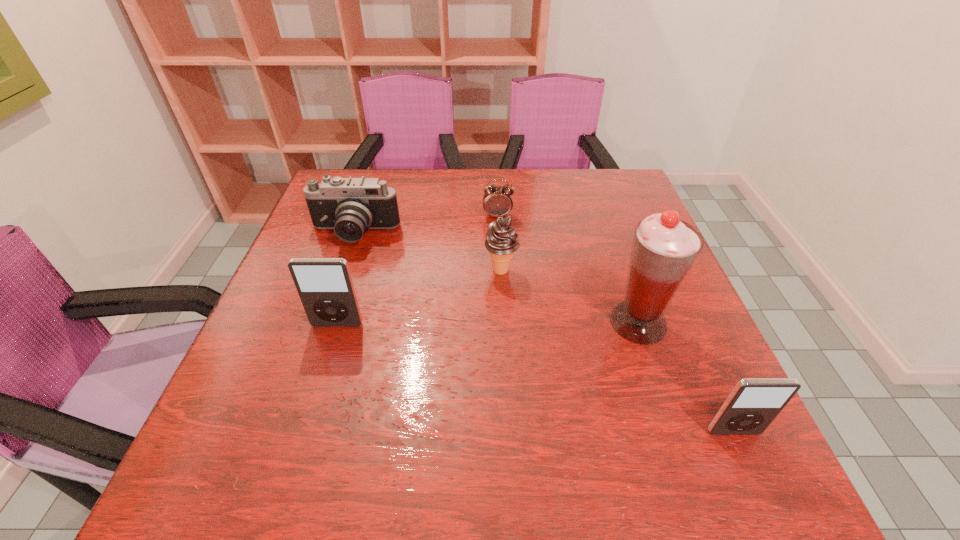
Where is `free area in between the third farthest object and the shorter iPod`? free area in between the third farthest object and the shorter iPod is located at coordinates (617, 352).

I want to click on vacant point located between the taller iPod and the smoothie, so click(x=488, y=323).

Image resolution: width=960 pixels, height=540 pixels. I want to click on empty space that is in between the camera and the icecream, so click(428, 253).

You are a GUI agent. You are given a task and a screenshot of the screen. Output one action in this format:
    pyautogui.click(x=<x>, y=<y>)
    Task: Click on the empty space that is in between the camera and the nearer iPod
    The height and width of the screenshot is (540, 960).
    Given the screenshot: What is the action you would take?
    pyautogui.click(x=544, y=333)

Find the location of a particular element. The width and height of the screenshot is (960, 540). blank region between the shortest object and the camera is located at coordinates (426, 225).

Locate which object is the closest to the icecream. Please provide its 2D coordinates. Your answer should be formatted as a tuple, i.e. [(x, y)], where the tuple contains the x and y coordinates of a point satisfying the conditions above.

[(497, 201)]

Identify which object is located as the fourth nearest to the second farthest object. Please provide its 2D coordinates. Your answer should be formatted as a tuple, i.e. [(x, y)], where the tuple contains the x and y coordinates of a point satisfying the conditions above.

[(664, 248)]

Locate an element on the screen. The image size is (960, 540). free region that satisfies the following two spatial constraints: 1. on the face of the shortest object; 2. on the left side of the tallest object is located at coordinates (503, 322).

The image size is (960, 540). Find the location of `blank area in the image that satisfies the following two spatial constraints: 1. on the face of the smoothie; 2. on the left side of the alarm clock`. blank area in the image that satisfies the following two spatial constraints: 1. on the face of the smoothie; 2. on the left side of the alarm clock is located at coordinates tap(503, 322).

Identify the location of vacant space that satisfies the following two spatial constraints: 1. on the front-facing side of the third farthest object; 2. on the left side of the camera. (343, 271).